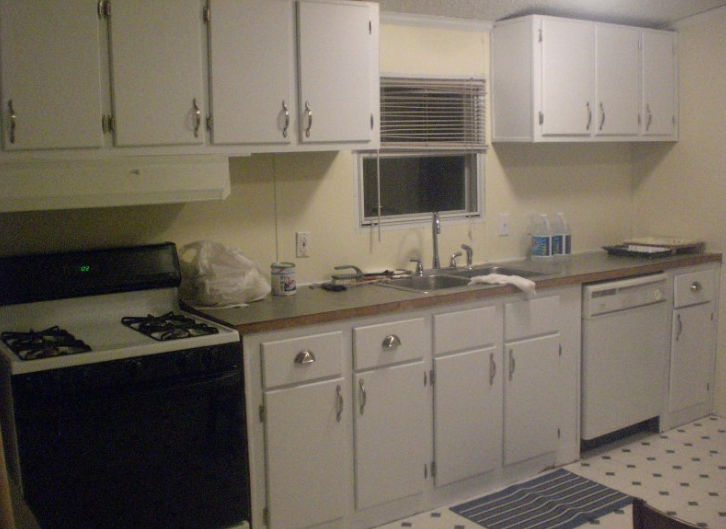
Find the location of a particular element. The width and height of the screenshot is (726, 529). window is located at coordinates (406, 170).